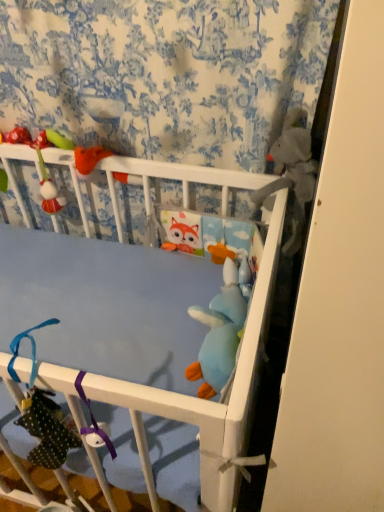
Question: From their relative heights in the image, would you say fuzzy fabric plush at upper left, the fourth toy positioned from the right, is taller or shorter than gray plush toy at upper right, which ranks as the 4th toy in left-to-right order?

Choices:
 (A) short
 (B) tall

Answer: (B)

Question: From the image's perspective, relative to gray plush toy at upper right, which ranks as the 4th toy in left-to-right order, is fuzzy fabric plush at upper left, the fourth toy positioned from the right, above or below?

Choices:
 (A) above
 (B) below

Answer: (A)

Question: Which object is positioned closest to the soft blue plush toy at center, the second toy viewed from the left?

Choices:
 (A) blue plush toy at center, acting as the 2th toy starting from the right
 (B) gray plush toy at upper right, marked as the first toy in a right-to-left arrangement
 (C) fuzzy fabric plush at upper left, the fourth toy positioned from the right

Answer: (A)

Question: Which of these objects is positioned closest to the fuzzy fabric plush at upper left, which ranks as the first toy in left-to-right order?

Choices:
 (A) soft blue plush toy at center, the second toy viewed from the left
 (B) gray plush toy at upper right, which ranks as the 4th toy in left-to-right order
 (C) blue plush toy at center, which is the 3th toy in left-to-right order

Answer: (C)